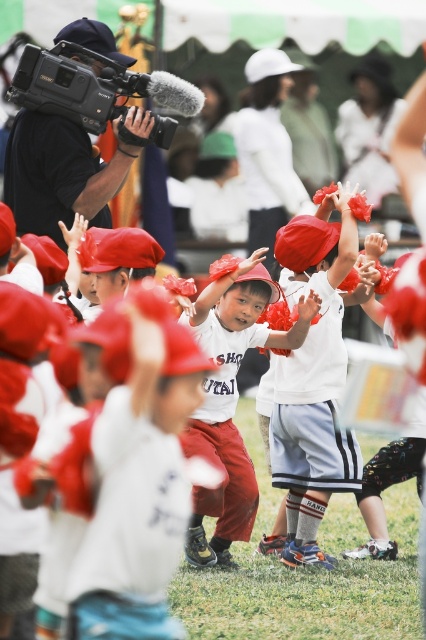
You are a photographer trying to capture a clear shot of the two shirts mentioned. Since both are at the center, how can you adjust your camera angle to focus on the matte white shirt at center without obscuring the white cotton shirt at center?

Since the matte white shirt at center is located above the white cotton shirt at center, you can angle your camera slightly downward to focus on the matte white shirt at center while keeping the white cotton shirt at center visible below it.

You are a photographer trying to capture the children dancing in the center of the image. You have a black plastic video camera at upper left. Can you see the white cotton shirt at center through the camera lens without moving the camera?

The white cotton shirt at center is in front of the black plastic video camera at upper left, so the photographer cannot see the white cotton shirt at center through the camera lens without moving the camera because it is blocking the view.